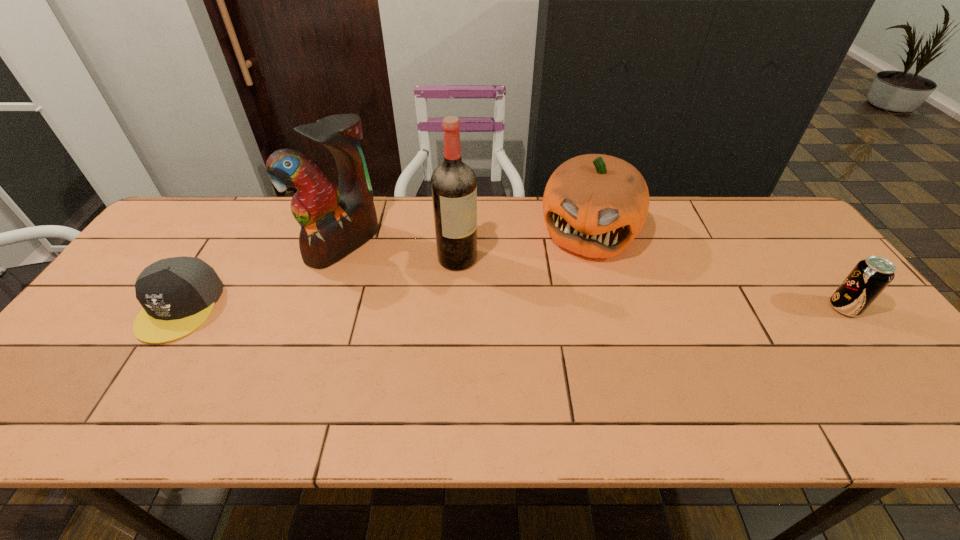
The image size is (960, 540). What are the coordinates of `free space located on the left of the fourth tallest object` in the screenshot? It's located at (690, 308).

Locate an element on the screen. The height and width of the screenshot is (540, 960). vacant point located 0.280m on the face of the third shortest object is located at coordinates (552, 336).

Identify the location of free space located 0.200m on the face of the third shortest object. The width and height of the screenshot is (960, 540). (561, 313).

This screenshot has width=960, height=540. I want to click on vacant space situated 0.210m on the face of the third shortest object, so click(x=560, y=315).

Locate an element on the screen. Image resolution: width=960 pixels, height=540 pixels. vacant space located 0.230m on the front-facing side of the liquor is located at coordinates (531, 314).

Find the location of `free region located 0.210m on the front-facing side of the liquor`. free region located 0.210m on the front-facing side of the liquor is located at coordinates (525, 309).

Where is `free space located 0.240m on the front-facing side of the liquor`? The image size is (960, 540). free space located 0.240m on the front-facing side of the liquor is located at coordinates (534, 316).

You are a GUI agent. You are given a task and a screenshot of the screen. Output one action in this format:
    pyautogui.click(x=<x>, y=<y>)
    Task: Click on the vacant space situated at the face of the parrot
    Image resolution: width=960 pixels, height=540 pixels.
    Given the screenshot: What is the action you would take?
    pyautogui.click(x=393, y=280)

Find the location of a particular element. Image resolution: width=960 pixels, height=540 pixels. free location located at the face of the parrot is located at coordinates (451, 321).

At what (x,y) coordinates should I click in order to perform the action: click on vacant space situated at the face of the parrot. Please return your answer as a coordinate pair (x, y). Looking at the image, I should click on (463, 329).